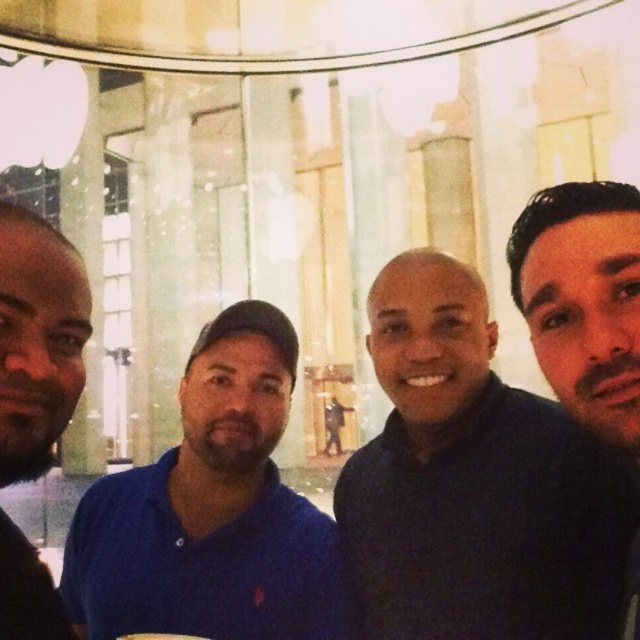
You are a photographer trying to capture a photo of the dark blue sweater at center and the blue cotton polo shirt at center. Since both are at the center, how can you determine which one is closer to the camera?

The dark blue sweater at center is located above the blue cotton polo shirt at center, so the sweater is closer to the camera because objects closer to the camera appear higher in the frame due to perspective.

You are standing in the room and want to hand a gift to the person wearing the dark blue sweater at center and the blue cotton polo shirt at center. Which one can you reach first without moving closer?

The dark blue sweater at center is closer to the viewer than the blue cotton polo shirt at center, so you can reach the person wearing the dark blue sweater at center first without moving closer.

You are a photographer trying to capture a candid shot of the dark brown hair at upper right and the dark blue shirt at left. Based on their positions, can you tell which subject is higher in the frame?

The dark brown hair at upper right is above the dark blue shirt at left, so the dark brown hair at upper right is higher in the frame.